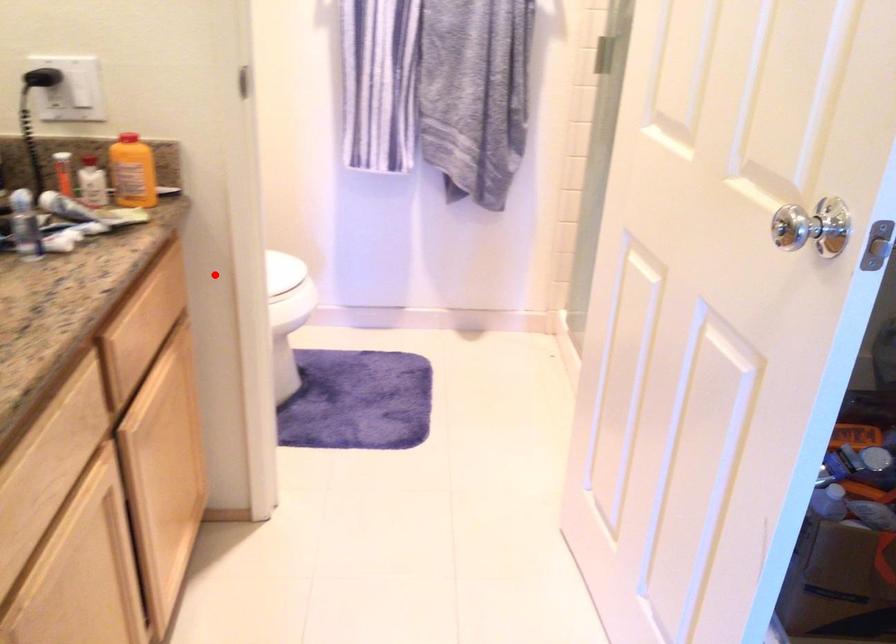
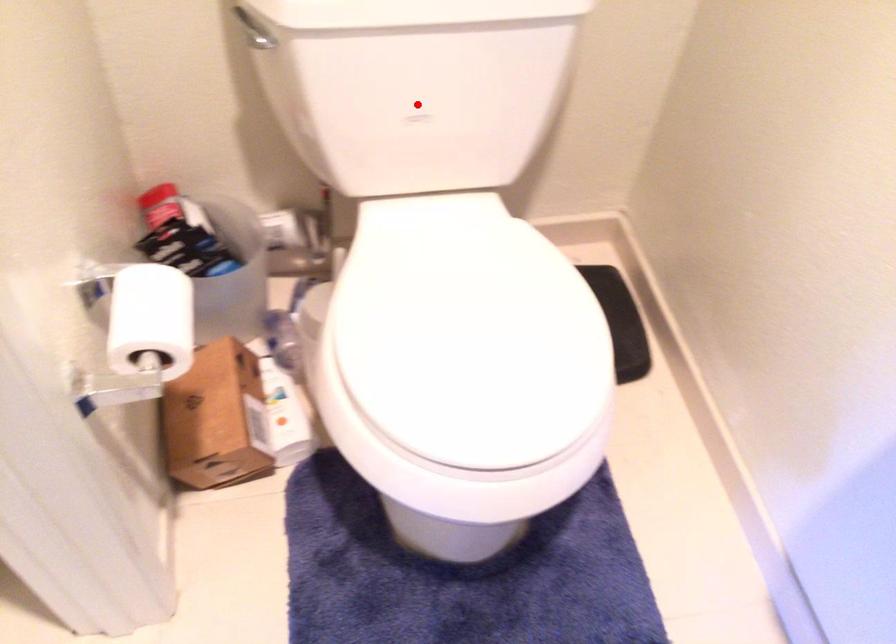
I am providing you with two images of the same scene from different viewpoints. A red point is marked on the first image and another point is marked on the second image. Do the highlighted points in image1 and image2 indicate the same real-world spot?

No